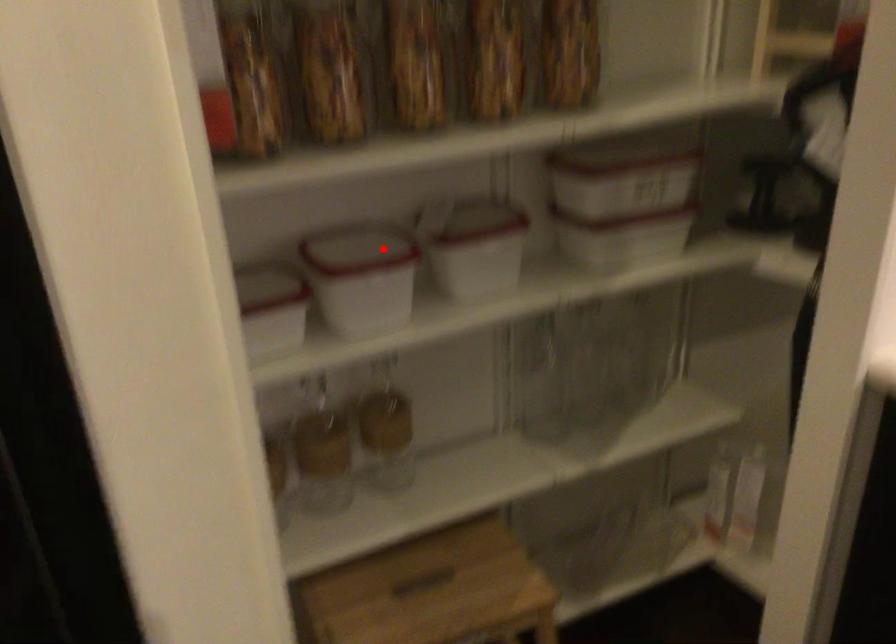
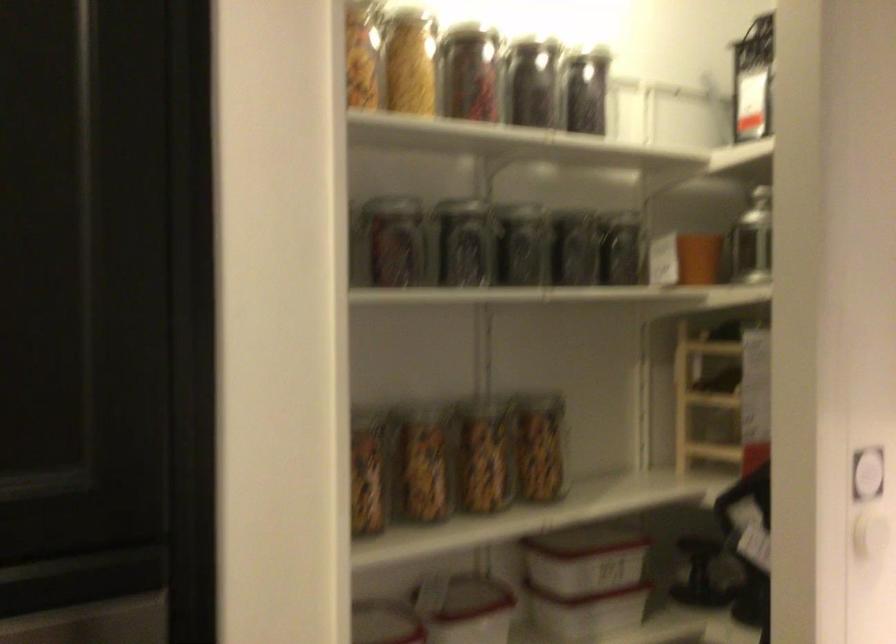
Question: I am providing you with two images of the same scene from different viewpoints. A red point is marked on the first image. Can you still see the location of the red point in image 2?

Choices:
 (A) Yes
 (B) No

Answer: (A)